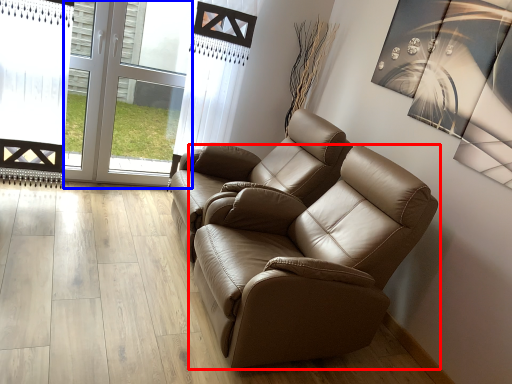
Question: Which object appears closest to the camera in this image, chair (highlighted by a red box) or glass door (highlighted by a blue box)?

Choices:
 (A) chair
 (B) glass door

Answer: (A)